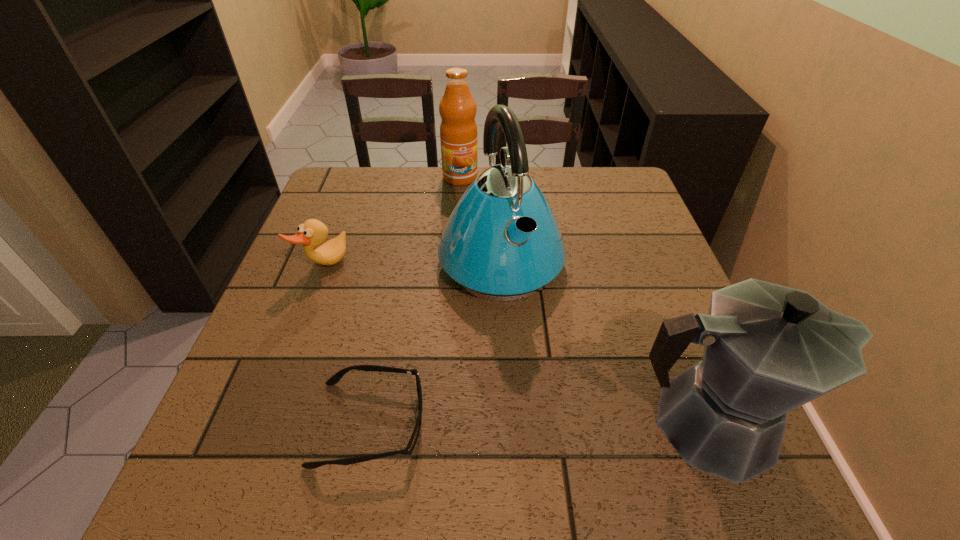
I want to click on free space on the desktop that is between the shortest object and the rightmost object and is positioned on the label side of the fruit juice, so click(520, 423).

The image size is (960, 540). What are the coordinates of `free space on the desktop that is between the shortest object and the rightmost object and is positioned on the beak of the duck` in the screenshot? It's located at (562, 424).

What are the coordinates of `vacant spot on the desktop that is between the spectacles and the rightmost object and is positioned at the spout of the tallest object` in the screenshot? It's located at (578, 424).